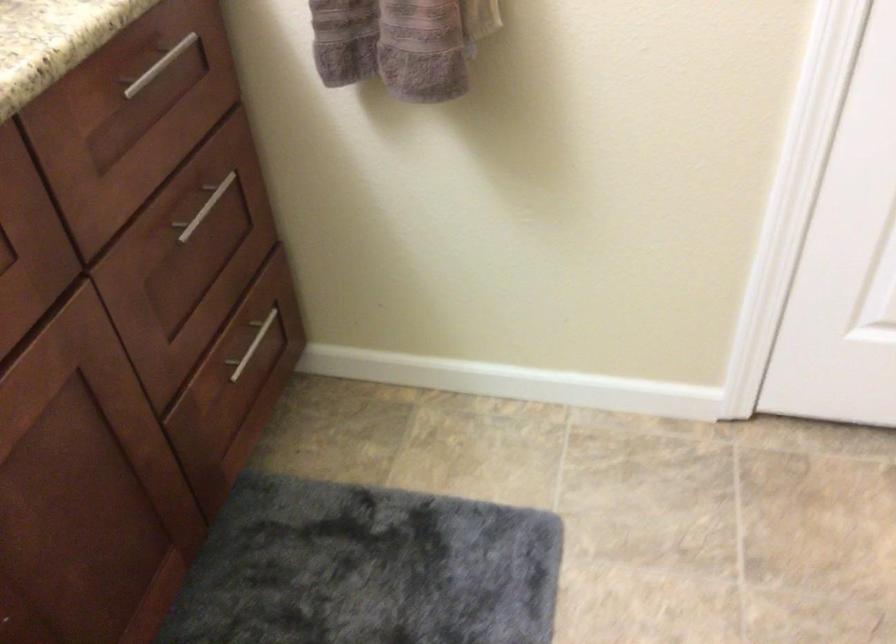
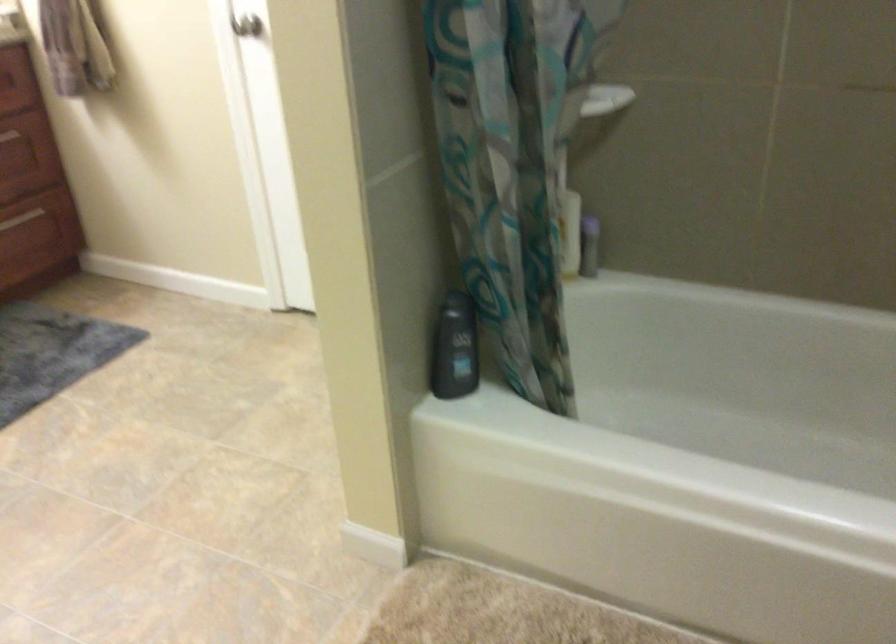
In a continuous first-person perspective shot, in which direction is the camera moving?

The cameraman walked toward right, backward.